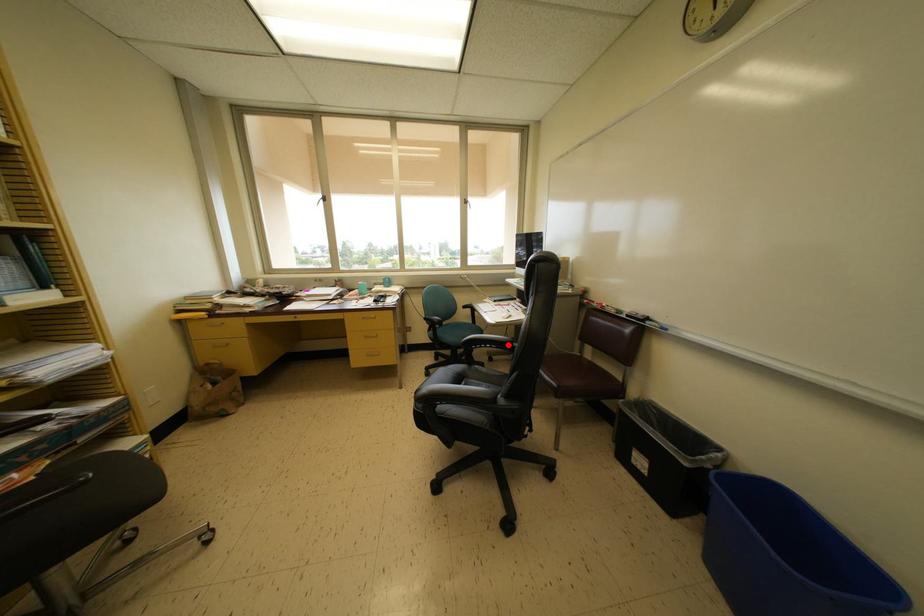
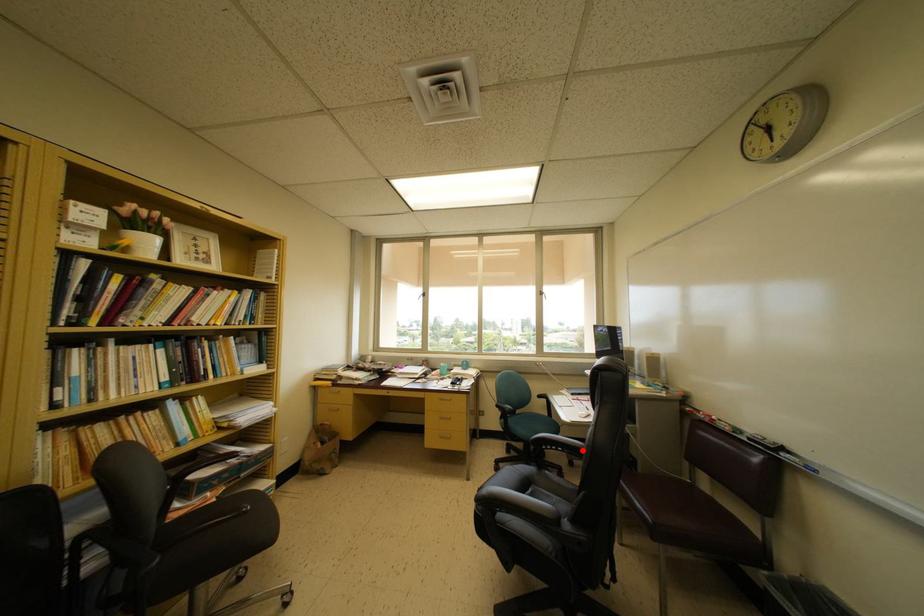
I am providing you with two images of the same scene from different viewpoints. A red point is marked on the first image and another point is marked on the second image. Do the highlighted points in image1 and image2 indicate the same real-world spot?

Yes